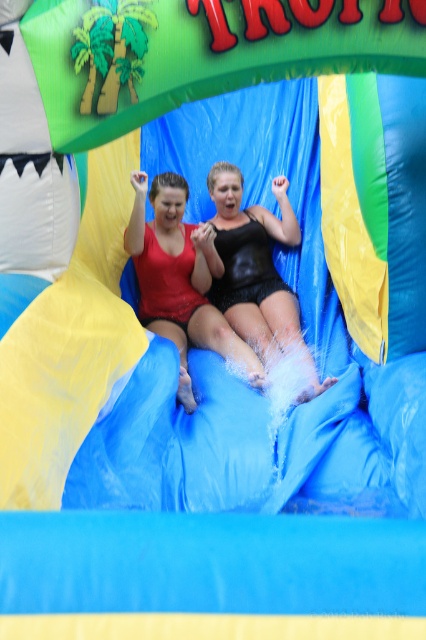
Consider the image. You are designing a safety poster for the water slide and need to ensure visibility of all swimmers. Given that the matte red swimsuit at center and the black shiny shorts at center are both in the center, which swimmer might be harder to see from above due to their height?

The matte red swimsuit at center is not as tall as black shiny shorts at center, so the swimmer in the matte red swimsuit at center might be harder to see from above because they are shorter.

You are at a water park and see two people sliding down a colorful water slide. You notice a matte red swimsuit at center and a black shiny shorts at center. Which one is positioned lower on the slide?

The matte red swimsuit at center is below black shiny shorts at center, so the matte red swimsuit at center is positioned lower on the slide.

You are standing at the bottom of the water slide and want to locate the matte red swimsuit at center. Which direction should you look to find it?

You should look towards the center of the slide to find the matte red swimsuit at center, as it is located at point coordinates of [178,280].